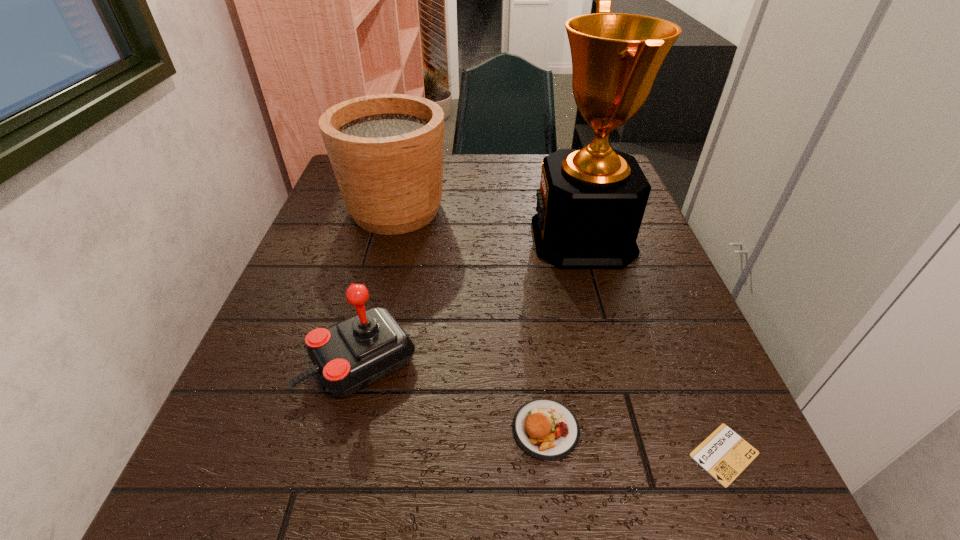
You are a GUI agent. You are given a task and a screenshot of the screen. Output one action in this format:
    pyautogui.click(x=<x>, y=<y>)
    Task: Click on the free space located on the back of the second shortest object
    
    Given the screenshot: What is the action you would take?
    pyautogui.click(x=526, y=262)

Where is `vacant region located 0.400m on the back of the identity card`? The height and width of the screenshot is (540, 960). vacant region located 0.400m on the back of the identity card is located at coordinates (640, 256).

This screenshot has height=540, width=960. I want to click on object that is at the far edge, so click(386, 150).

Where is `object at the near edge`? Image resolution: width=960 pixels, height=540 pixels. object at the near edge is located at coordinates (724, 454).

The image size is (960, 540). Find the location of `flowerpot at the left edge`. flowerpot at the left edge is located at coordinates (386, 150).

You are a GUI agent. You are given a task and a screenshot of the screen. Output one action in this format:
    pyautogui.click(x=<x>, y=<y>)
    Task: Click on the joystick located at the left edge
    Image resolution: width=960 pixels, height=540 pixels.
    Given the screenshot: What is the action you would take?
    pyautogui.click(x=350, y=355)

Locate an element on the screen. trophy cup that is positioned at the right edge is located at coordinates (591, 202).

Find the location of a particular element. Image resolution: width=960 pixels, height=540 pixels. identity card positioned at the right edge is located at coordinates (724, 454).

Locate an element on the screen. object situated at the far left corner is located at coordinates (386, 150).

Where is `object at the near right corner`? The width and height of the screenshot is (960, 540). object at the near right corner is located at coordinates (724, 454).